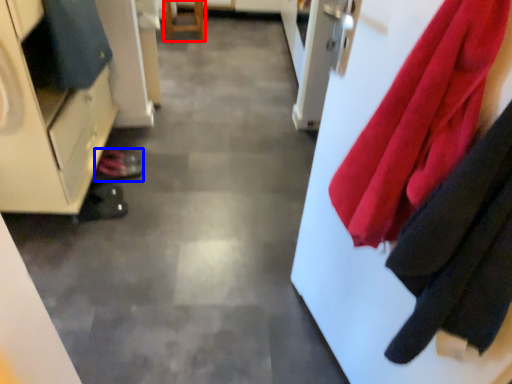
Question: Which object appears closest to the camera in this image, furniture (highlighted by a red box) or shoe (highlighted by a blue box)?

Choices:
 (A) furniture
 (B) shoe

Answer: (B)